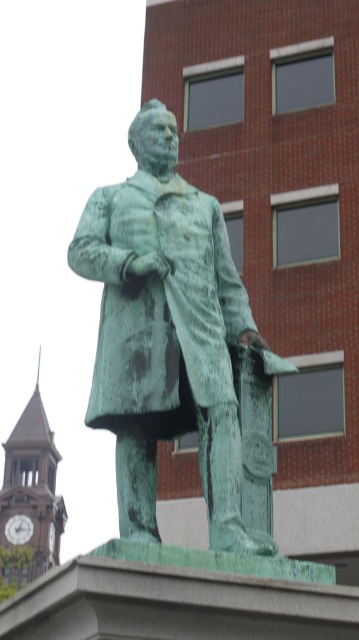
Question: Does green patina statue at center come behind brown wooden clock tower at left?

Choices:
 (A) no
 (B) yes

Answer: (A)

Question: Can you confirm if green patina statue at center is smaller than brown wooden clock tower at left?

Choices:
 (A) no
 (B) yes

Answer: (B)

Question: Does green patina statue at center appear under brown wooden clock tower at left?

Choices:
 (A) no
 (B) yes

Answer: (A)

Question: Which of the following is the closest to the observer?

Choices:
 (A) green patina statue at center
 (B) brown wooden clock tower at left

Answer: (A)